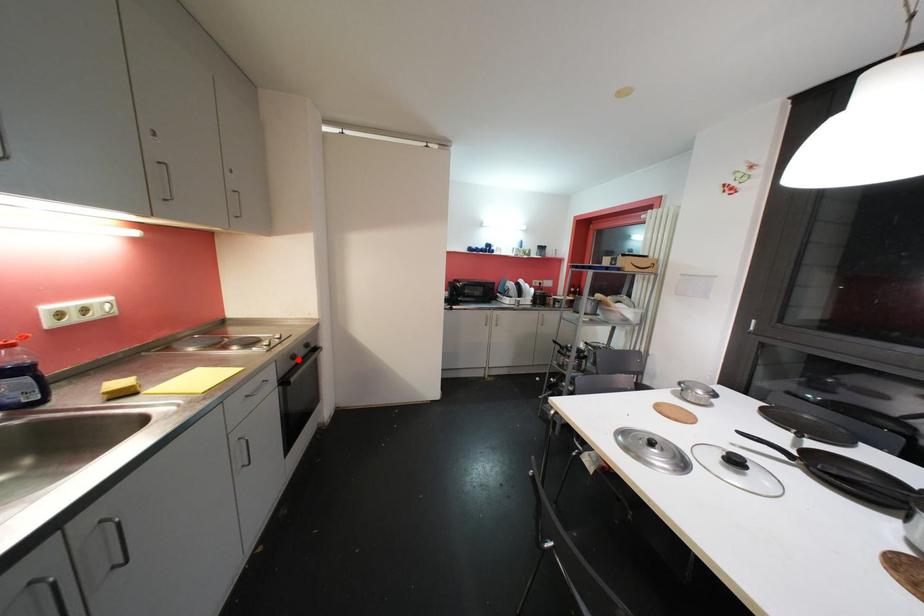
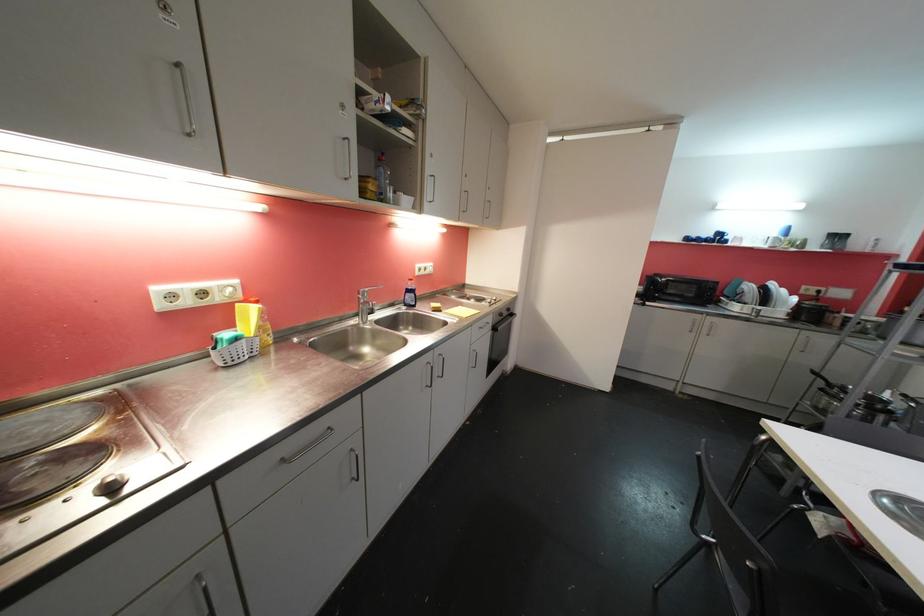
Question: I am providing you with two images of the same scene from different viewpoints. Given a red point in image1, look at the same physical point in image2. Is it:

Choices:
 (A) Closer to the viewpoint
 (B) Farther from the viewpoint

Answer: (B)